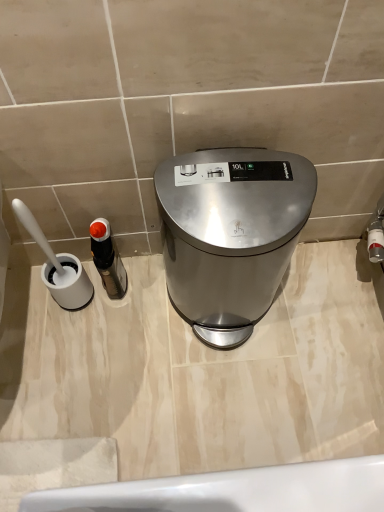
What do you see at coordinates (107, 259) in the screenshot?
I see `black plastic bottle at left` at bounding box center [107, 259].

At what (x,y) coordinates should I click in order to perform the action: click on black plastic bottle at left. Please return your answer as a coordinate pair (x, y). This screenshot has height=512, width=384. Looking at the image, I should click on (107, 259).

What do you see at coordinates (230, 234) in the screenshot?
I see `satin silver trash can at center` at bounding box center [230, 234].

What are the coordinates of `satin silver trash can at center` in the screenshot? It's located at coord(230,234).

Find the location of `black plastic bottle at left`. black plastic bottle at left is located at coordinates (107, 259).

Is black plastic bottle at left to the left of satin silver trash can at center from the viewer's perspective?

Indeed, black plastic bottle at left is positioned on the left side of satin silver trash can at center.

Considering their positions, is black plastic bottle at left located in front of or behind satin silver trash can at center?

Clearly, black plastic bottle at left is behind satin silver trash can at center.

Considering the points (113, 252) and (254, 181), which point is behind, point (113, 252) or point (254, 181)?

The point (113, 252) is behind.

From the image's perspective, is black plastic bottle at left above or below satin silver trash can at center?

black plastic bottle at left is situated lower than satin silver trash can at center in the image.

From a real-world perspective, is black plastic bottle at left above or below satin silver trash can at center?

black plastic bottle at left is below satin silver trash can at center.

Does black plastic bottle at left have a greater width compared to satin silver trash can at center?

No.

Can you confirm if black plastic bottle at left is shorter than satin silver trash can at center?

Correct, black plastic bottle at left is not as tall as satin silver trash can at center.

Considering the relative sizes of black plastic bottle at left and satin silver trash can at center in the image provided, is black plastic bottle at left bigger than satin silver trash can at center?

No, black plastic bottle at left is not bigger than satin silver trash can at center.

Looking at this image, is black plastic bottle at left not within satin silver trash can at center?

Yes, black plastic bottle at left is located beyond the bounds of satin silver trash can at center.

Is black plastic bottle at left touching satin silver trash can at center?

No, black plastic bottle at left is not in contact with satin silver trash can at center.

Is black plastic bottle at left looking in the opposite direction of satin silver trash can at center?

No, black plastic bottle at left's orientation is not away from satin silver trash can at center.

At what (x,y) coordinates should I click in order to perform the action: click on waste container on the right side of black plastic bottle at left. Please return your answer as a coordinate pair (x, y). The height and width of the screenshot is (512, 384). Looking at the image, I should click on (230, 234).

Between satin silver trash can at center and black plastic bottle at left, which one appears on the right side from the viewer's perspective?

satin silver trash can at center is more to the right.

Considering the relative positions of satin silver trash can at center and black plastic bottle at left in the image provided, is satin silver trash can at center behind black plastic bottle at left?

No, it is not.

Does point (224, 181) appear closer or farther from the camera than point (100, 266)?

Point (224, 181) is positioned closer to the camera compared to point (100, 266).

From the image's perspective, is satin silver trash can at center located beneath black plastic bottle at left?

No.

From a real-world perspective, which is physically below, satin silver trash can at center or black plastic bottle at left?

In real-world perspective, black plastic bottle at left is lower.

Which object is wider, satin silver trash can at center or black plastic bottle at left?

satin silver trash can at center is wider.

Considering the sizes of objects satin silver trash can at center and black plastic bottle at left in the image provided, who is shorter, satin silver trash can at center or black plastic bottle at left?

Standing shorter between the two is black plastic bottle at left.

Based on their sizes in the image, would you say satin silver trash can at center is bigger or smaller than black plastic bottle at left?

In the image, satin silver trash can at center appears to be larger than black plastic bottle at left.

Is satin silver trash can at center inside or outside of black plastic bottle at left?

satin silver trash can at center is spatially situated outside black plastic bottle at left.

Are satin silver trash can at center and black plastic bottle at left beside each other?

No, satin silver trash can at center is not with black plastic bottle at left.

Is satin silver trash can at center looking in the opposite direction of black plastic bottle at left?

satin silver trash can at center does not have its back to black plastic bottle at left.

The image size is (384, 512). I want to click on bottle below the satin silver trash can at center (from the image's perspective), so click(x=107, y=259).

I want to click on bottle that is under the satin silver trash can at center (from a real-world perspective), so coord(107,259).

You are a GUI agent. You are given a task and a screenshot of the screen. Output one action in this format:
    pyautogui.click(x=<x>, y=<y>)
    Task: Click on the bottle on the left of the satin silver trash can at center
    The width and height of the screenshot is (384, 512).
    Given the screenshot: What is the action you would take?
    pyautogui.click(x=107, y=259)